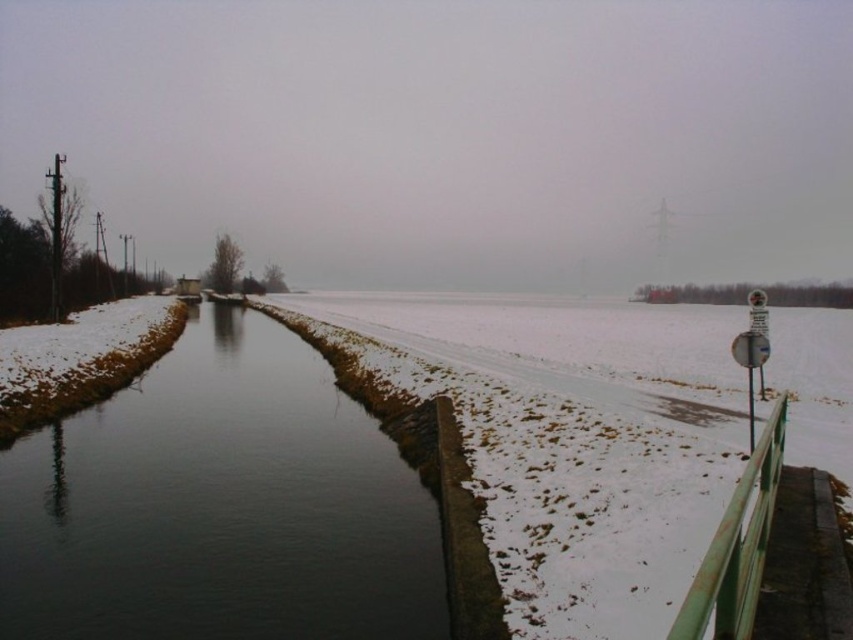
You are standing on the snowy path next to the concrete barrier. You want to cross to the other side of the waterway. Can you step onto the green painted metal rail at right to reach the dark water at center?

The dark water at center is further to the viewer than the green painted metal rail at right, so stepping onto the rail would not allow you to reach the water since it is closer to you than the water.

You are standing on the snowy path next to the concrete barrier. You want to locate the dark water at center. According to the coordinates provided, in which direction should you look relative to your position?

You should look towards the center of the waterway from your position on the snowy path next to the concrete barrier, as the dark water at center is located at point (218, 506).

In the scene shown: You are a photographer planning to capture the winter scene. You want to ensure that the dark water at center and the green painted metal rail at right are both visible in your shot. Based on their sizes, which object should you focus on to include both in the frame?

The dark water at center is wider than the green painted metal rail at right, so focusing on the dark water at center would allow both objects to fit in the frame since it occupies more space.